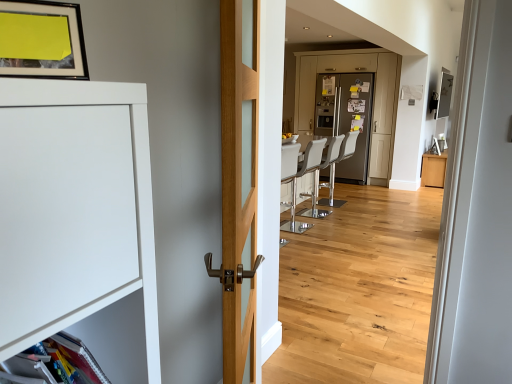
Question: Considering the positions of point (311, 225) and point (272, 4), is point (311, 225) closer or farther from the camera than point (272, 4)?

Choices:
 (A) closer
 (B) farther

Answer: (B)

Question: From their relative heights in the image, would you say white leather barstool at center, which appears as the 1th armchair when viewed from the front, is taller or shorter than wooden floor at center?

Choices:
 (A) short
 (B) tall

Answer: (A)

Question: Based on their relative distances, which object is farther from the white leather barstool at center, which is the second armchair in front-to-back order?

Choices:
 (A) white leather barstool at center, acting as the 1th armchair starting from the back
 (B) white leather barstool at center, acting as the 3th armchair starting from the back
 (C) satin silver refrigerator at center, arranged as the second screen door when viewed from the right
 (D) light oak wood door at center
 (E) wooden floor at center

Answer: (D)

Question: Which object is the closest to the satin silver refrigerator at center, positioned as the first screen door in left-to-right order?

Choices:
 (A) matte black picture frame at upper left
 (B) white leather barstool at center, the 3th armchair in the front-to-back sequence
 (C) wooden floor at center
 (D) silver metallic refrigerator at center, marked as the first screen door in a right-to-left arrangement
 (E) white leather barstool at center, which appears as the 1th armchair when viewed from the front

Answer: (D)